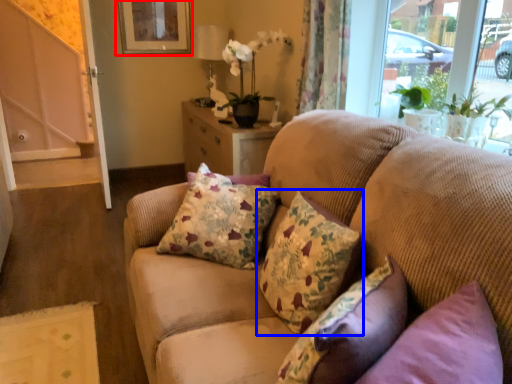
Question: Which of the following is the closest to the observer, picture frame (highlighted by a red box) or pillow (highlighted by a blue box)?

Choices:
 (A) picture frame
 (B) pillow

Answer: (B)